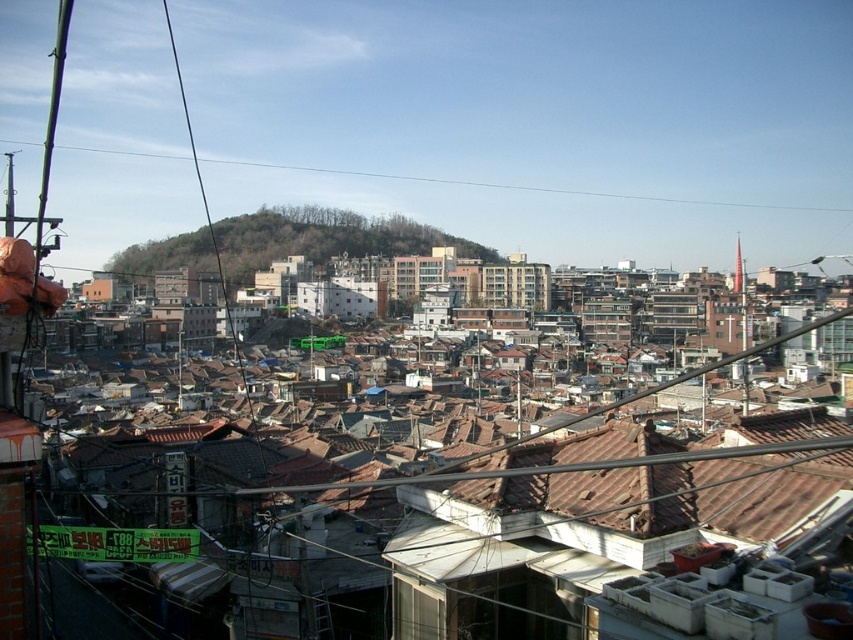
Question: Does green grassy hillside at center come behind black wire at upper left?

Choices:
 (A) yes
 (B) no

Answer: (B)

Question: Does green grassy hillside at center appear under black wire at upper left?

Choices:
 (A) no
 (B) yes

Answer: (B)

Question: Where is green grassy hillside at center located in relation to black wire at upper left in the image?

Choices:
 (A) left
 (B) right

Answer: (A)

Question: Which point appears farthest from the camera in this image?

Choices:
 (A) (421, 237)
 (B) (572, 195)

Answer: (B)

Question: Among these objects, which one is nearest to the camera?

Choices:
 (A) green grassy hillside at center
 (B) black wire at upper left

Answer: (A)